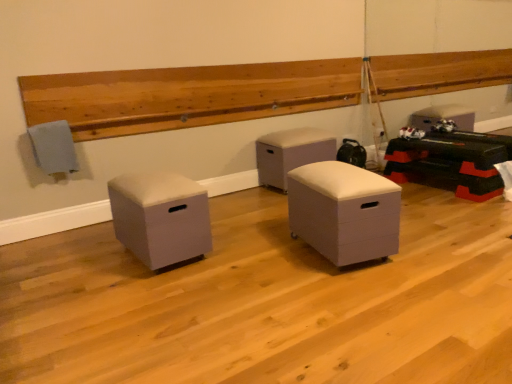
Question: Considering the relative sizes of matte gray ottoman at left, the second furniture positioned from the back, and white matte storage ottoman at center, which is counted as the third furniture, starting from the back, in the image provided, is matte gray ottoman at left, the second furniture positioned from the back, thinner than white matte storage ottoman at center, which is counted as the third furniture, starting from the back,?

Choices:
 (A) yes
 (B) no

Answer: (B)

Question: From the image's perspective, is matte gray ottoman at left, which is the 1th furniture from left to right, below white matte storage ottoman at center, which is counted as the third furniture, starting from the back?

Choices:
 (A) no
 (B) yes

Answer: (B)

Question: Does matte gray ottoman at left, the third furniture when ordered from right to left, lie in front of white matte storage ottoman at center, which ranks as the 1th furniture in right-to-left order?

Choices:
 (A) no
 (B) yes

Answer: (A)

Question: Is matte gray ottoman at left, which is the 2th furniture in front-to-back order, next to white matte storage ottoman at center, which is counted as the third furniture, starting from the left, and touching it?

Choices:
 (A) no
 (B) yes

Answer: (A)

Question: Is matte gray ottoman at left, which is the 1th furniture from left to right, located outside white matte storage ottoman at center, which is counted as the third furniture, starting from the left?

Choices:
 (A) yes
 (B) no

Answer: (A)

Question: Is matte gray ottoman at left, which is the 2th furniture in front-to-back order, bigger or smaller than white leather ottoman at center, the 1th furniture in the back-to-front sequence?

Choices:
 (A) small
 (B) big

Answer: (A)

Question: Is matte gray ottoman at left, the third furniture when ordered from right to left, wider or thinner than white leather ottoman at center, the 2th furniture in the right-to-left sequence?

Choices:
 (A) wide
 (B) thin

Answer: (A)

Question: Is matte gray ottoman at left, which is the 2th furniture in front-to-back order, spatially inside white leather ottoman at center, the 2th furniture in the right-to-left sequence, or outside of it?

Choices:
 (A) outside
 (B) inside

Answer: (A)

Question: From a real-world perspective, is matte gray ottoman at left, the second furniture positioned from the back, positioned above or below white leather ottoman at center, acting as the 2th furniture starting from the left?

Choices:
 (A) above
 (B) below

Answer: (B)

Question: In the image, is white leather ottoman at center, acting as the 2th furniture starting from the left, positioned in front of or behind matte gray ottoman at left, which is the 1th furniture from left to right?

Choices:
 (A) behind
 (B) front

Answer: (A)

Question: Is white leather ottoman at center, which appears as the 3th furniture when viewed from the front, inside the boundaries of matte gray ottoman at left, the third furniture when ordered from right to left, or outside?

Choices:
 (A) outside
 (B) inside

Answer: (A)

Question: Is white leather ottoman at center, the 2th furniture in the right-to-left sequence, bigger or smaller than matte gray ottoman at left, the second furniture positioned from the back?

Choices:
 (A) big
 (B) small

Answer: (A)

Question: In the image, is white leather ottoman at center, the 2th furniture in the right-to-left sequence, on the left side or the right side of matte gray ottoman at left, which is the 2th furniture in front-to-back order?

Choices:
 (A) right
 (B) left

Answer: (A)

Question: From the image's perspective, is white matte storage ottoman at center, the first furniture viewed from the front, above or below white leather ottoman at center, the 1th furniture in the back-to-front sequence?

Choices:
 (A) below
 (B) above

Answer: (A)

Question: Is white matte storage ottoman at center, which ranks as the 1th furniture in right-to-left order, inside or outside of white leather ottoman at center, which appears as the 3th furniture when viewed from the front?

Choices:
 (A) inside
 (B) outside

Answer: (B)